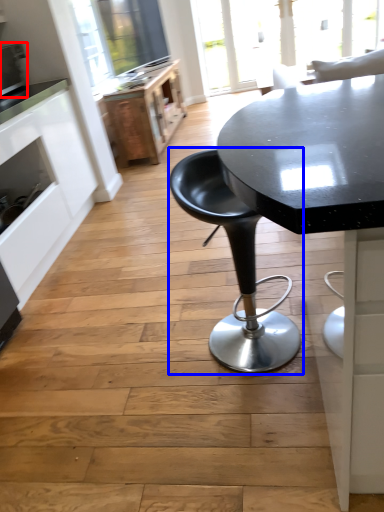
Question: Among these objects, which one is nearest to the camera, appliance (highlighted by a red box) or chair (highlighted by a blue box)?

Choices:
 (A) appliance
 (B) chair

Answer: (B)